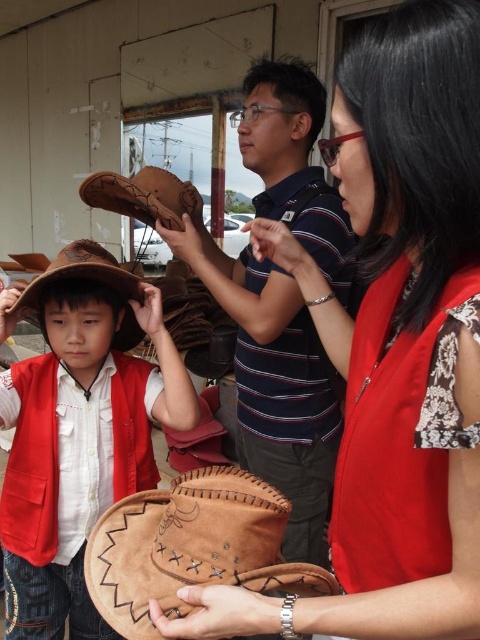
Question: Considering the real-world distances, which object is closest to the suede cowboy hat at center?

Choices:
 (A) brown suede cowboy hat at center
 (B) leather hat at center

Answer: (A)

Question: Which point is closer to the camera taking this photo?

Choices:
 (A) (84, 266)
 (B) (26, 307)
 (C) (96, 564)
 (D) (386, 221)

Answer: (D)

Question: Does brown suede cowboy hat at center have a lesser width compared to brown suede cowboy hat at left?

Choices:
 (A) no
 (B) yes

Answer: (A)

Question: Is leather hat at center closer to the viewer compared to brown suede cowboy hat at left?

Choices:
 (A) yes
 (B) no

Answer: (A)

Question: Which of the following is the closest to the observer?

Choices:
 (A) brown suede cowboy hat at center
 (B) brown suede cowboy hat at left
 (C) suede cowboy hat at center

Answer: (A)

Question: Does leather hat at center appear on the right side of brown suede cowboy hat at center?

Choices:
 (A) yes
 (B) no

Answer: (A)